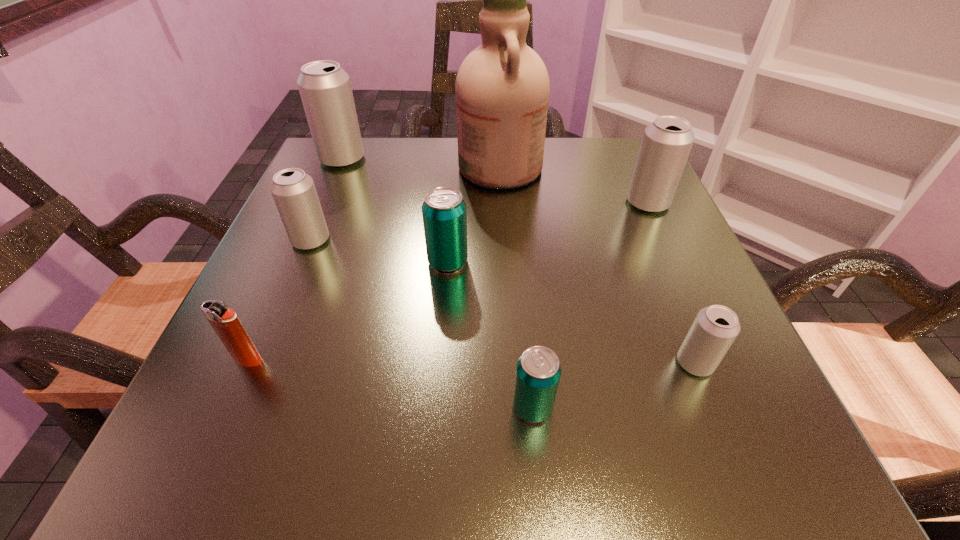
Locate an element on the screen. Image resolution: width=960 pixels, height=540 pixels. vacant point that satisfies the following two spatial constraints: 1. on the back side of the smaller teal beer can; 2. on the front label of the tallest object is located at coordinates (511, 167).